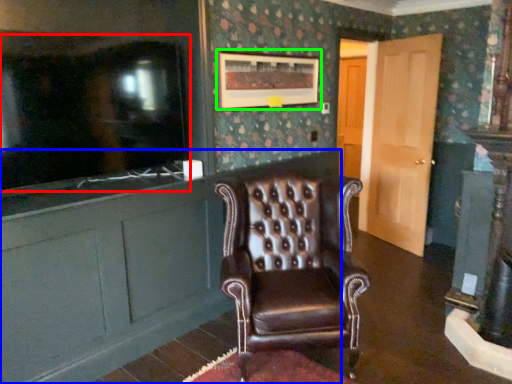
Question: Which object is positioned farthest from tv show (highlighted by a red box)? Select from cabinetry (highlighted by a blue box) and picture frame (highlighted by a green box).

Choices:
 (A) cabinetry
 (B) picture frame

Answer: (B)